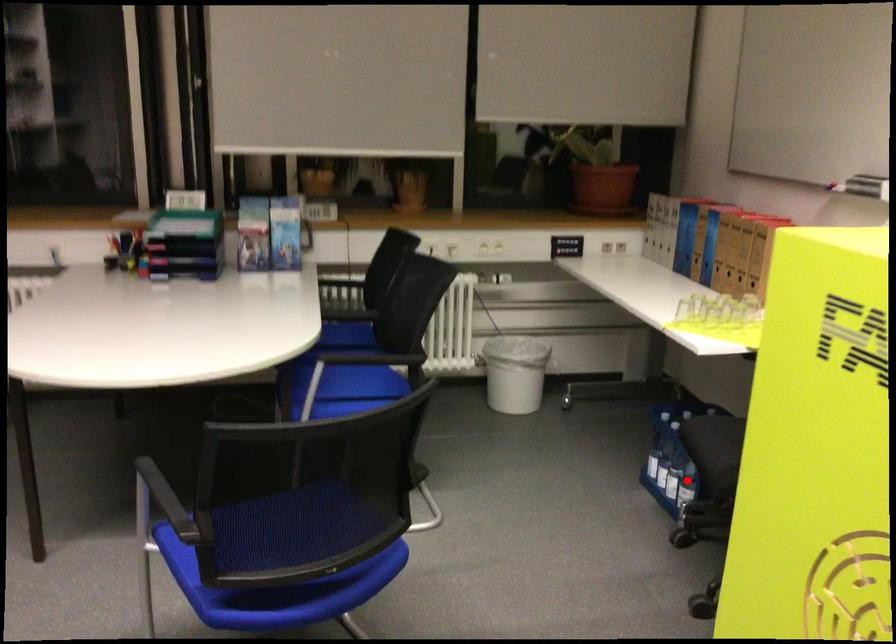
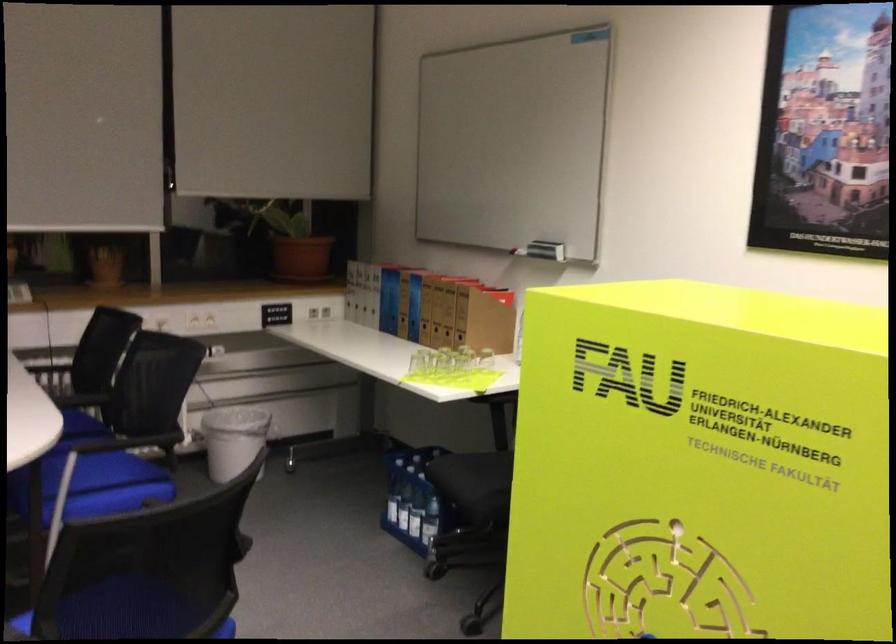
The point at the highlighted location is marked in the first image. Where is the corresponding point in the second image?

(429, 520)